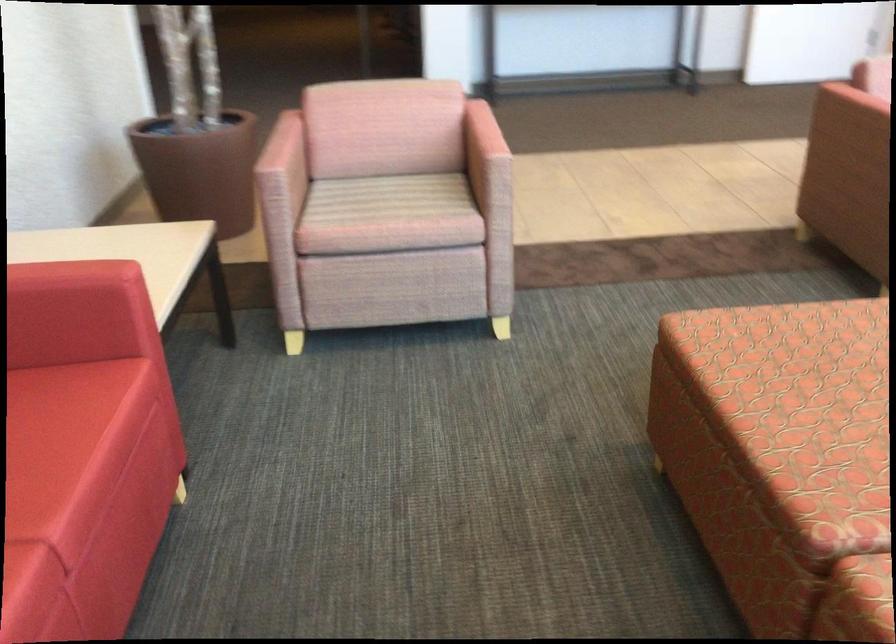
Image resolution: width=896 pixels, height=644 pixels. I want to click on red sofa armrest, so click(x=76, y=272).